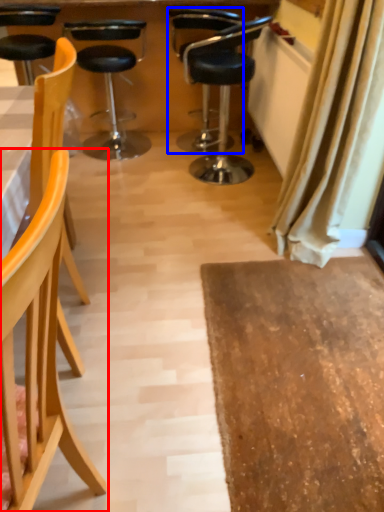
Question: Which point is closer to the camera, chair (highlighted by a red box) or chair (highlighted by a blue box)?

Choices:
 (A) chair
 (B) chair

Answer: (A)